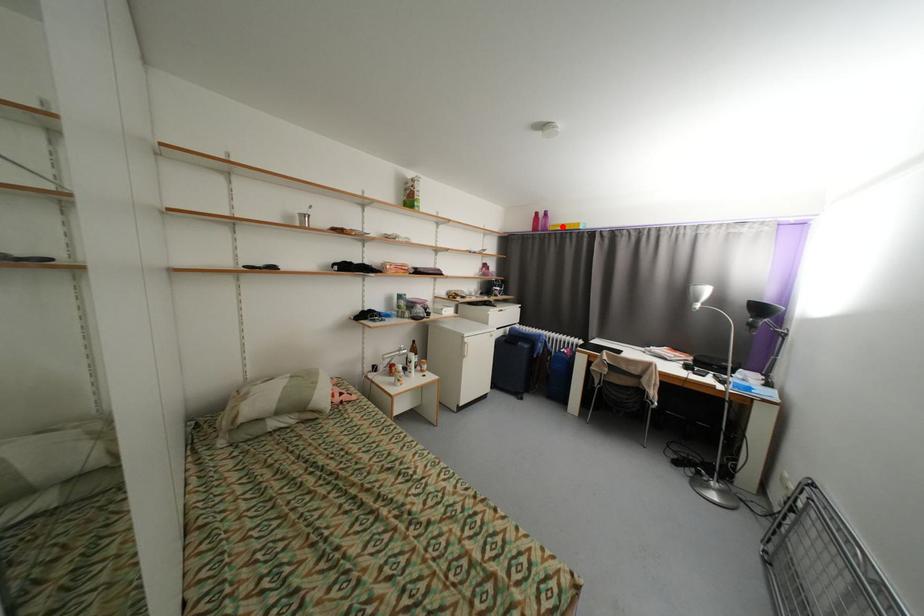
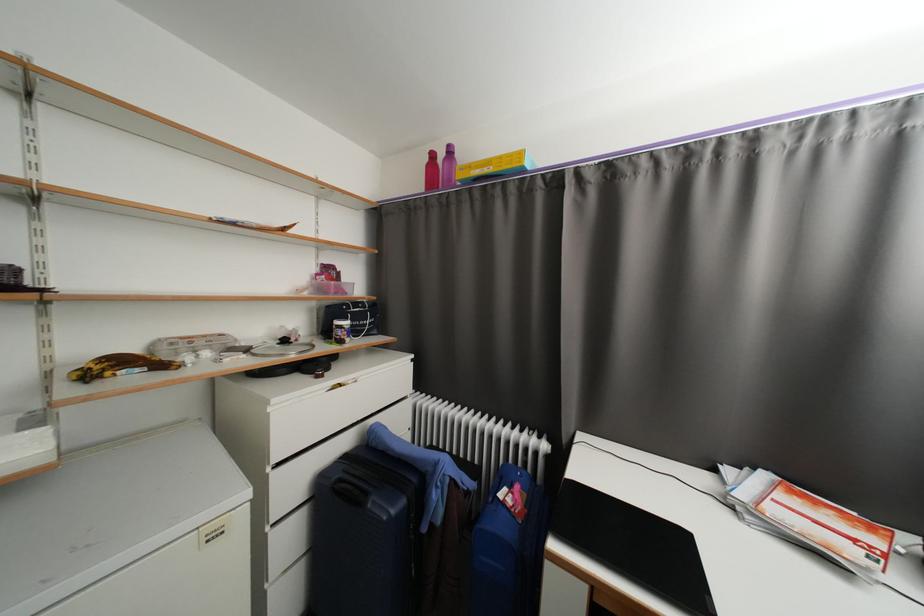
The point at the highlighted location is marked in the first image. Where is the corresponding point in the second image?

(476, 168)